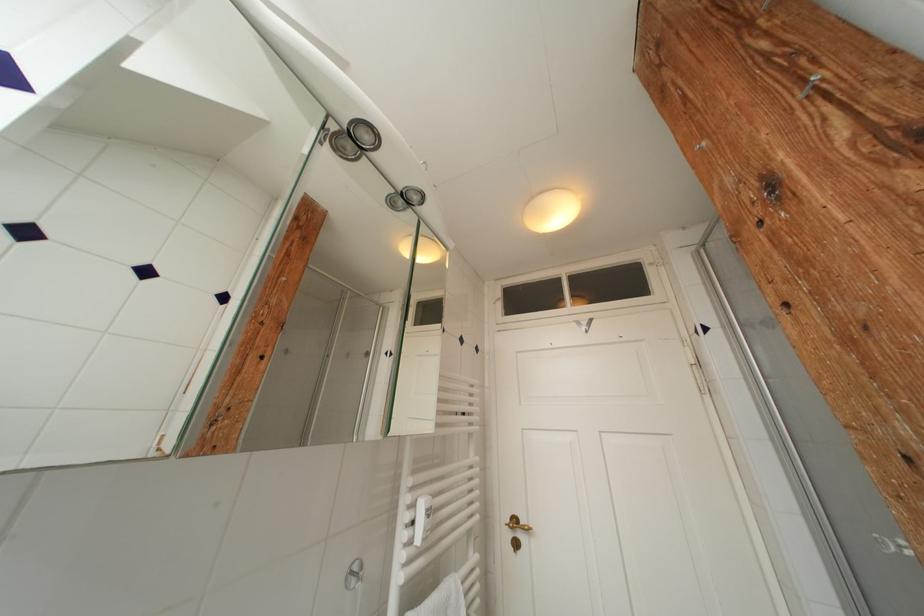
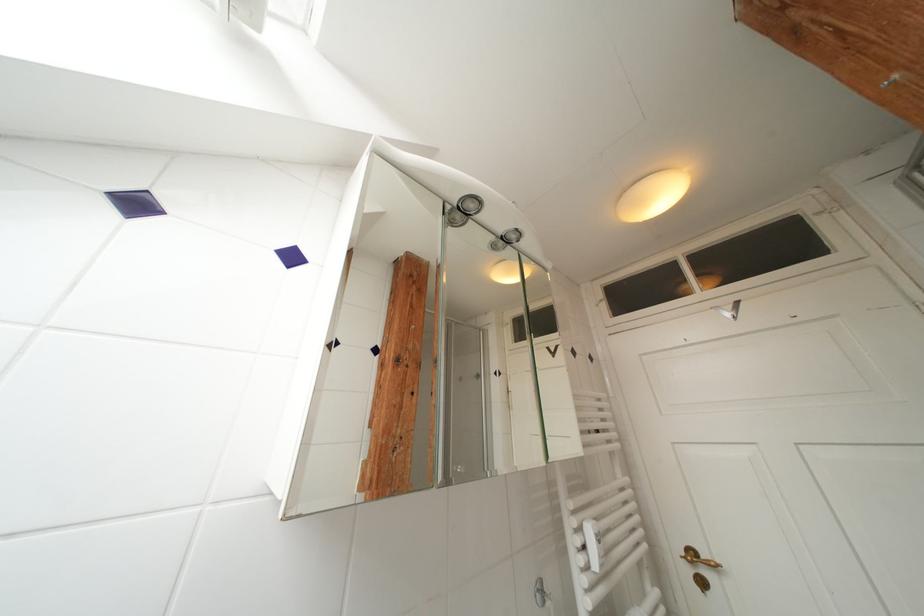
The point at (393,358) is marked in the first image. Where is the corresponding point in the second image?

(502, 377)